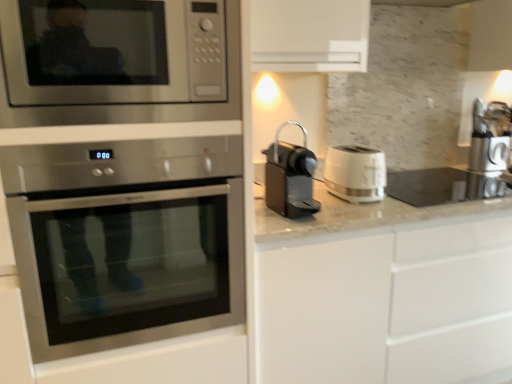
Describe the element at coordinates (355, 173) in the screenshot. I see `white plastic toaster at right` at that location.

Find the location of a particular element. The height and width of the screenshot is (384, 512). black plastic coffee machine at center, the 2th coffee machine when ordered from right to left is located at coordinates (290, 177).

The image size is (512, 384). Find the location of `white marble countertop at right`. white marble countertop at right is located at coordinates (377, 206).

Describe the element at coordinates (377, 206) in the screenshot. I see `white marble countertop at right` at that location.

I want to click on white plastic toaster at right, so click(355, 173).

Does point (421, 279) lie behind point (291, 151)?

Yes, point (421, 279) is behind point (291, 151).

Is white glossy cabinet at center facing towards black plastic coffee machine at center, the first coffee machine from the front?

No, white glossy cabinet at center is not facing towards black plastic coffee machine at center, the first coffee machine from the front.

Is white glossy cabinet at center taller or shorter than black plastic coffee machine at center, the first coffee machine from the front?

Clearly, white glossy cabinet at center is taller compared to black plastic coffee machine at center, the first coffee machine from the front.

Consider the image. Is white glossy cabinet at center touching black plastic coffee machine at center, the 2th coffee machine when ordered from right to left?

white glossy cabinet at center and black plastic coffee machine at center, the 2th coffee machine when ordered from right to left, are not in contact.

Consider the image. Is white glossy cabinet at center aimed at satin silver coffee machine at right, placed as the 1th coffee machine when sorted from back to front?

No.

Based on the photo, between white glossy cabinet at center and satin silver coffee machine at right, the 1th coffee machine viewed from the right, which one is positioned in front?

Positioned in front is white glossy cabinet at center.

Considering the positions of objects white glossy cabinet at center and satin silver coffee machine at right, the 2th coffee machine when ordered from front to back, in the image provided, who is more to the left, white glossy cabinet at center or satin silver coffee machine at right, the 2th coffee machine when ordered from front to back,?

Positioned to the left is white glossy cabinet at center.

From the image's perspective, is white glossy cabinet at center under satin silver coffee machine at right, the 2th coffee machine when ordered from front to back?

Indeed, from the image's perspective, white glossy cabinet at center is shown beneath satin silver coffee machine at right, the 2th coffee machine when ordered from front to back.

Between black plastic coffee machine at center, the 2th coffee machine when ordered from right to left, and satin silver coffee machine at right, the 2th coffee machine when ordered from front to back, which one has larger width?

Wider between the two is satin silver coffee machine at right, the 2th coffee machine when ordered from front to back.

Consider the image. Considering the relative positions of black plastic coffee machine at center, which ranks as the second coffee machine in back-to-front order, and satin silver coffee machine at right, the second coffee machine from the left, in the image provided, is black plastic coffee machine at center, which ranks as the second coffee machine in back-to-front order, to the right of satin silver coffee machine at right, the second coffee machine from the left, from the viewer's perspective?

No, black plastic coffee machine at center, which ranks as the second coffee machine in back-to-front order, is not to the right of satin silver coffee machine at right, the second coffee machine from the left.

Is black plastic coffee machine at center, the 2th coffee machine when ordered from right to left, next to satin silver coffee machine at right, the second coffee machine from the left?

No, black plastic coffee machine at center, the 2th coffee machine when ordered from right to left, is not next to satin silver coffee machine at right, the second coffee machine from the left.

Which is less distant, [265,181] or [508,141]?

The point [265,181] is closer.

From a real-world perspective, is white plastic toaster at right over white glossy cabinet at center?

Yes, from a real-world perspective, white plastic toaster at right is over white glossy cabinet at center

From the picture: Is white plastic toaster at right beside white glossy cabinet at center?

No, white plastic toaster at right is not with white glossy cabinet at center.

Does point (380, 184) lie in front of point (398, 337)?

Yes, point (380, 184) is in front of point (398, 337).

Does white plastic toaster at right have a greater height compared to white glossy cabinet at center?

No.

From the image's perspective, between white plastic toaster at right and satin silver coffee machine at right, placed as the 1th coffee machine when sorted from back to front, who is located below?

white plastic toaster at right appears lower in the image.

Is white plastic toaster at right taller or shorter than satin silver coffee machine at right, placed as the 1th coffee machine when sorted from back to front?

In the image, white plastic toaster at right appears to be shorter than satin silver coffee machine at right, placed as the 1th coffee machine when sorted from back to front.

Which is behind, point (342, 195) or point (472, 160)?

The point (472, 160) is farther from the camera.

From a real-world perspective, who is located higher, white plastic toaster at right or satin silver coffee machine at right, placed as the 1th coffee machine when sorted from back to front?

In real-world perspective, satin silver coffee machine at right, placed as the 1th coffee machine when sorted from back to front, is above.

How different are the orientations of white glossy cabinet at center and stainless steel oven at left in degrees?

white glossy cabinet at center and stainless steel oven at left are facing 0.684 degrees away from each other.

Does white glossy cabinet at center have a lesser width compared to stainless steel oven at left?

Yes, white glossy cabinet at center is thinner than stainless steel oven at left.

From a real-world perspective, is white glossy cabinet at center on stainless steel oven at left?

No, from a real-world perspective, white glossy cabinet at center is not over stainless steel oven at left

Between point (287, 352) and point (61, 299), which one is positioned in front?

The point (287, 352) is in front.

Is white plastic toaster at right situated inside white marble countertop at right or outside?

white plastic toaster at right is not inside white marble countertop at right, it's outside.

Between white plastic toaster at right and white marble countertop at right, which one has more height?

white plastic toaster at right.

Is white plastic toaster at right facing towards white marble countertop at right?

No, white plastic toaster at right does not turn towards white marble countertop at right.

You are a GUI agent. You are given a task and a screenshot of the screen. Output one action in this format:
    pyautogui.click(x=<x>, y=<y>)
    Task: Click on the cabinetry lying below the black plastic coffee machine at center, which ranks as the second coffee machine in back-to-front order (from the image's perspective)
    The height and width of the screenshot is (384, 512).
    Given the screenshot: What is the action you would take?
    pyautogui.click(x=389, y=304)

This screenshot has width=512, height=384. I want to click on coffee machine on the right of the white glossy cabinet at center, so click(x=490, y=137).

Which object lies further to the anchor point stainless steel oven at left, white plastic toaster at right or satin silver coffee machine at right, the 2th coffee machine when ordered from front to back?

satin silver coffee machine at right, the 2th coffee machine when ordered from front to back, is further to stainless steel oven at left.

From the image, which object appears to be farther from satin silver coffee machine at right, the 1th coffee machine viewed from the right, white plastic toaster at right or stainless steel oven at left?

Based on the image, stainless steel oven at left appears to be further to satin silver coffee machine at right, the 1th coffee machine viewed from the right.

When comparing their distances from white glossy cabinet at center, does stainless steel microwave at upper left or black plastic coffee machine at center, which ranks as the first coffee machine in left-to-right order, seem closer?

black plastic coffee machine at center, which ranks as the first coffee machine in left-to-right order, is positioned closer to the anchor white glossy cabinet at center.

Consider the image. Based on their spatial positions, is white glossy cabinet at center or satin silver coffee machine at right, the second coffee machine from the left, further from stainless steel oven at left?

The object further to stainless steel oven at left is satin silver coffee machine at right, the second coffee machine from the left.

Which object lies further to the anchor point white plastic toaster at right, stainless steel microwave at upper left or satin silver coffee machine at right, the 2th coffee machine when ordered from front to back?

Based on the image, satin silver coffee machine at right, the 2th coffee machine when ordered from front to back, appears to be further to white plastic toaster at right.

Based on their spatial positions, is stainless steel oven at left or satin silver coffee machine at right, the 2th coffee machine when ordered from front to back, closer to black plastic coffee machine at center, the 2th coffee machine when ordered from right to left?

stainless steel oven at left lies closer to black plastic coffee machine at center, the 2th coffee machine when ordered from right to left, than the other object.

From the image, which object appears to be farther from satin silver coffee machine at right, the 1th coffee machine viewed from the right, stainless steel oven at left or white plastic toaster at right?

stainless steel oven at left lies further to satin silver coffee machine at right, the 1th coffee machine viewed from the right, than the other object.

Based on their spatial positions, is satin silver coffee machine at right, the 2th coffee machine when ordered from front to back, or stainless steel microwave at upper left further from stainless steel oven at left?

satin silver coffee machine at right, the 2th coffee machine when ordered from front to back, is further to stainless steel oven at left.

Identify the location of cabinetry situated between white plastic toaster at right and satin silver coffee machine at right, the 1th coffee machine viewed from the right, from left to right. (389, 304).

The image size is (512, 384). I want to click on coffee machine between stainless steel oven at left and white glossy cabinet at center, so click(x=290, y=177).

Locate an element on the screen. oven between stainless steel microwave at upper left and white marble countertop at right is located at coordinates (126, 240).

Identify the location of cabinetry located between black plastic coffee machine at center, the 2th coffee machine when ordered from right to left, and satin silver coffee machine at right, the 2th coffee machine when ordered from front to back, in the left-right direction. The image size is (512, 384). (389, 304).